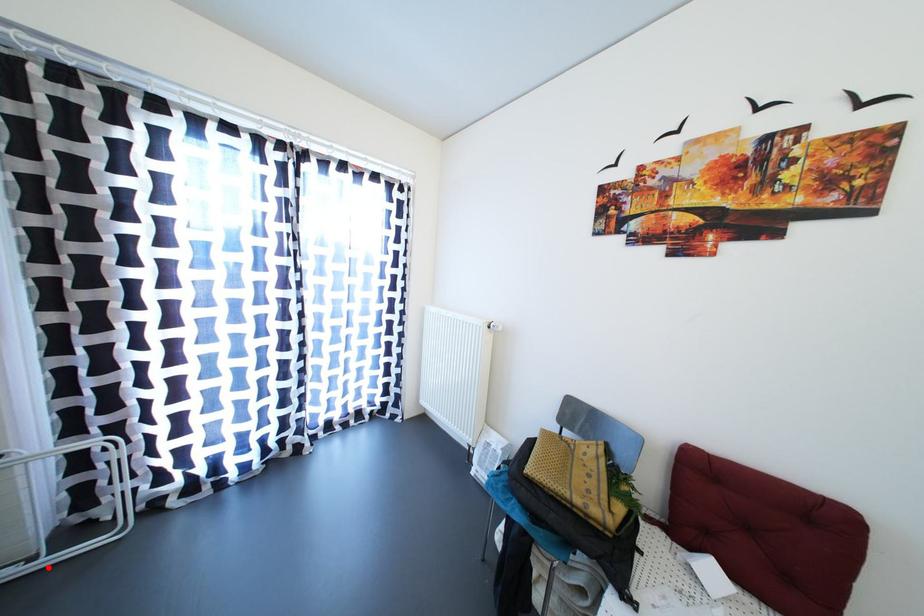
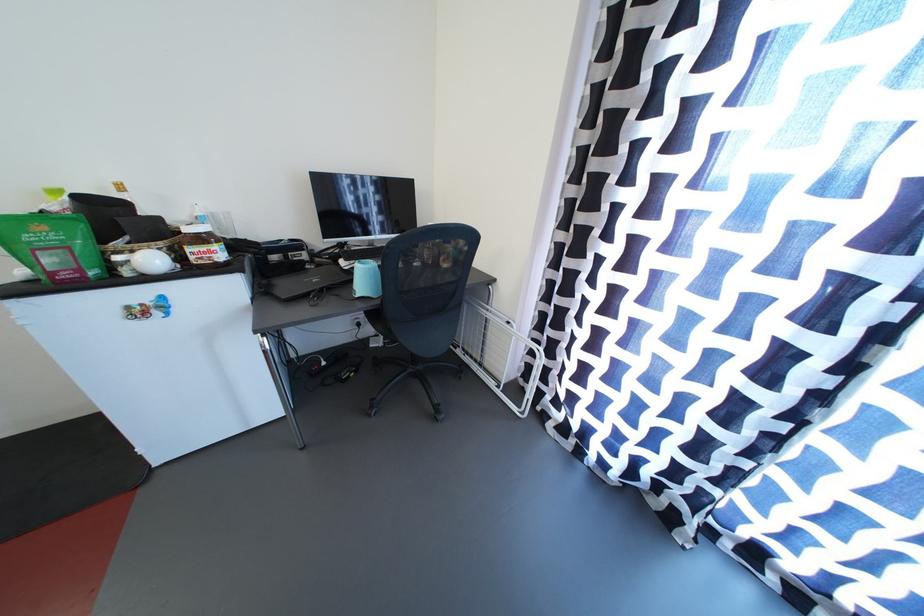
Question: I am providing you with two images of the same scene from different viewpoints. A red point is marked on the first image. Is the red point's position out of view in image 2?

Choices:
 (A) Yes
 (B) No

Answer: (B)